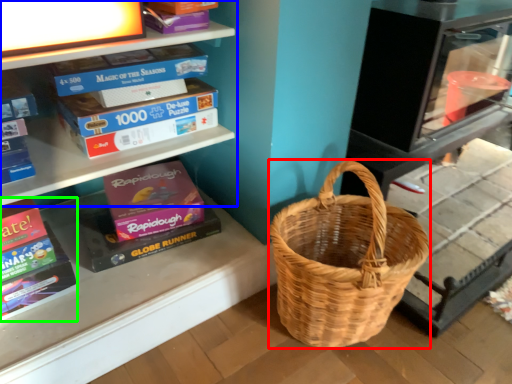
Question: Estimate the real-world distances between objects in this image. Which object is closer to picnic basket (highlighted by a red box), shelf (highlighted by a blue box) or paperback book (highlighted by a green box)?

Choices:
 (A) shelf
 (B) paperback book

Answer: (A)